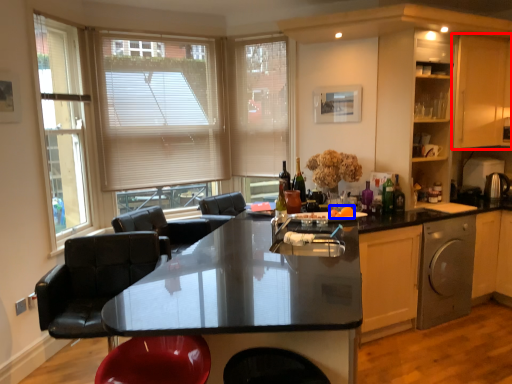
Question: Which of the following is the closest to the observer, cabinetry (highlighted by a red box) or food (highlighted by a blue box)?

Choices:
 (A) cabinetry
 (B) food

Answer: (B)